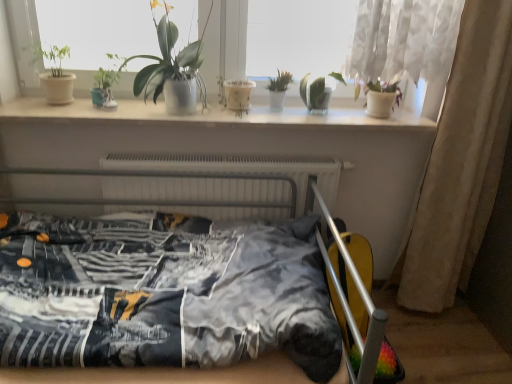
Question: From the image's perspective, is white glossy window sill at upper center located above green matte plant pot at upper left, the 5th houseplant when ordered from right to left?

Choices:
 (A) no
 (B) yes

Answer: (A)

Question: Does white glossy window sill at upper center have a greater width compared to green matte plant pot at upper left, the 5th houseplant when ordered from right to left?

Choices:
 (A) yes
 (B) no

Answer: (A)

Question: Can you confirm if white glossy window sill at upper center is smaller than green matte plant pot at upper left, arranged as the first houseplant when viewed from the left?

Choices:
 (A) yes
 (B) no

Answer: (B)

Question: From a real-world perspective, is white glossy window sill at upper center on green matte plant pot at upper left, the 5th houseplant when ordered from right to left?

Choices:
 (A) no
 (B) yes

Answer: (A)

Question: From the image's perspective, is white glossy window sill at upper center under green matte plant pot at upper left, arranged as the first houseplant when viewed from the left?

Choices:
 (A) yes
 (B) no

Answer: (A)

Question: Can you confirm if white glossy window sill at upper center is bigger than green matte plant pot at upper left, the 5th houseplant when ordered from right to left?

Choices:
 (A) yes
 (B) no

Answer: (A)

Question: Is translucent glass vase at upper center, which appears as the 1th houseplant when viewed from the right, outside printed fabric bed at center?

Choices:
 (A) yes
 (B) no

Answer: (A)

Question: Is translucent glass vase at upper center, positioned as the 5th houseplant in left-to-right order, touching printed fabric bed at center?

Choices:
 (A) yes
 (B) no

Answer: (B)

Question: Is translucent glass vase at upper center, positioned as the 5th houseplant in left-to-right order, positioned behind printed fabric bed at center?

Choices:
 (A) no
 (B) yes

Answer: (B)

Question: Is translucent glass vase at upper center, which appears as the 1th houseplant when viewed from the right, far away from printed fabric bed at center?

Choices:
 (A) no
 (B) yes

Answer: (A)

Question: Would you say printed fabric bed at center is part of translucent glass vase at upper center, which appears as the 1th houseplant when viewed from the right,'s contents?

Choices:
 (A) no
 (B) yes

Answer: (A)

Question: Considering the relative positions of translucent glass vase at upper center, positioned as the 5th houseplant in left-to-right order, and printed fabric bed at center in the image provided, is translucent glass vase at upper center, positioned as the 5th houseplant in left-to-right order, to the left of printed fabric bed at center from the viewer's perspective?

Choices:
 (A) no
 (B) yes

Answer: (A)

Question: From a real-world perspective, does green glossy plant at upper center, the third houseplant from the right, sit lower than white sheer curtain at right?

Choices:
 (A) no
 (B) yes

Answer: (A)